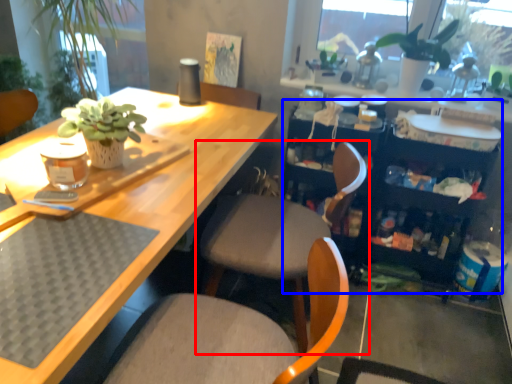
Question: Which object is closer to the camera taking this photo, chair (highlighted by a red box) or bookshelf (highlighted by a blue box)?

Choices:
 (A) chair
 (B) bookshelf

Answer: (A)